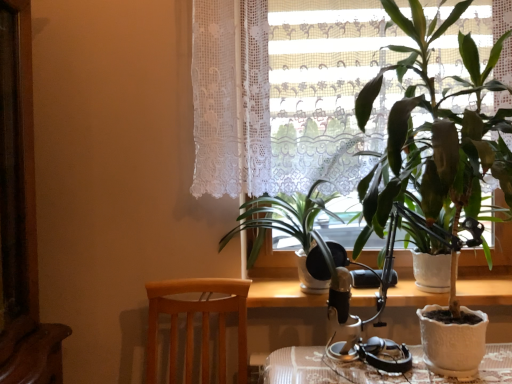
Question: From a real-world perspective, is green matte houseplant at right, the 1th houseplant positioned from the right, located higher than wooden table at center?

Choices:
 (A) no
 (B) yes

Answer: (B)

Question: Is green matte houseplant at right, the 1th houseplant positioned from the right, placed right next to wooden table at center?

Choices:
 (A) yes
 (B) no

Answer: (B)

Question: Does green matte houseplant at right, acting as the second houseplant starting from the left, have a larger size compared to wooden table at center?

Choices:
 (A) yes
 (B) no

Answer: (A)

Question: From the image's perspective, is green matte houseplant at right, the 1th houseplant positioned from the right, on top of wooden table at center?

Choices:
 (A) yes
 (B) no

Answer: (A)

Question: From the image's perspective, is green matte houseplant at right, acting as the second houseplant starting from the left, beneath wooden table at center?

Choices:
 (A) no
 (B) yes

Answer: (A)

Question: Considering the relative sizes of green matte houseplant at right, acting as the second houseplant starting from the left, and wooden table at center in the image provided, is green matte houseplant at right, acting as the second houseplant starting from the left, wider than wooden table at center?

Choices:
 (A) no
 (B) yes

Answer: (B)

Question: Is light brown wood chair at lower left positioned before wooden table at center?

Choices:
 (A) no
 (B) yes

Answer: (B)

Question: Can you confirm if light brown wood chair at lower left is taller than wooden table at center?

Choices:
 (A) yes
 (B) no

Answer: (A)

Question: Is there a large distance between light brown wood chair at lower left and wooden table at center?

Choices:
 (A) no
 (B) yes

Answer: (A)

Question: Can you confirm if light brown wood chair at lower left is shorter than wooden table at center?

Choices:
 (A) no
 (B) yes

Answer: (A)

Question: Considering the relative sizes of light brown wood chair at lower left and wooden table at center in the image provided, is light brown wood chair at lower left bigger than wooden table at center?

Choices:
 (A) no
 (B) yes

Answer: (B)

Question: From the image's perspective, does light brown wood chair at lower left appear lower than wooden table at center?

Choices:
 (A) no
 (B) yes

Answer: (B)

Question: Is wooden table at center aimed at white lace curtain at upper center?

Choices:
 (A) no
 (B) yes

Answer: (A)